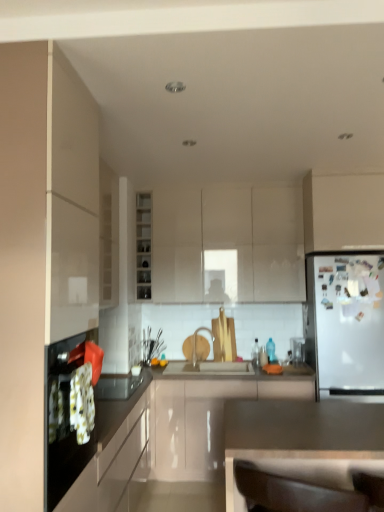
Question: Is point (246, 394) closer or farther from the camera than point (142, 194)?

Choices:
 (A) farther
 (B) closer

Answer: (B)

Question: Choose the correct answer: Is glossy white cabinet at center, positioned as the third cabinetry in back-to-front order, inside white glossy cabinet at center, which is the sixth cabinetry in front-to-back order, or outside it?

Choices:
 (A) outside
 (B) inside

Answer: (A)

Question: Estimate the real-world distances between objects in this image. Which object is closer to the matte white cabinet at left, arranged as the 1th cabinetry when viewed from the front?

Choices:
 (A) white glossy cabinet at center, which is the sixth cabinetry in front-to-back order
 (B) white matte refrigerator at right
 (C) black glossy oven at left, the 5th cabinetry viewed from the back
 (D) matte gray countertop at center, the first countertop viewed from the front
 (E) glossy white cabinet at center, positioned as the third cabinetry in back-to-front order

Answer: (C)

Question: Which object is positioned farthest from the glossy white cabinet at center, which is the 4th cabinetry in front-to-back order?

Choices:
 (A) white glossy cabinet at upper right, which is the fourth cabinetry in back-to-front order
 (B) matte white cabinet at left, arranged as the 1th cabinetry when viewed from the front
 (C) white glossy cabinet at center, acting as the first cabinetry starting from the back
 (D) matte gray countertop at center, acting as the 2th countertop starting from the back
 (E) matte white cabinet at center, the second cabinetry in the back-to-front sequence

Answer: (B)